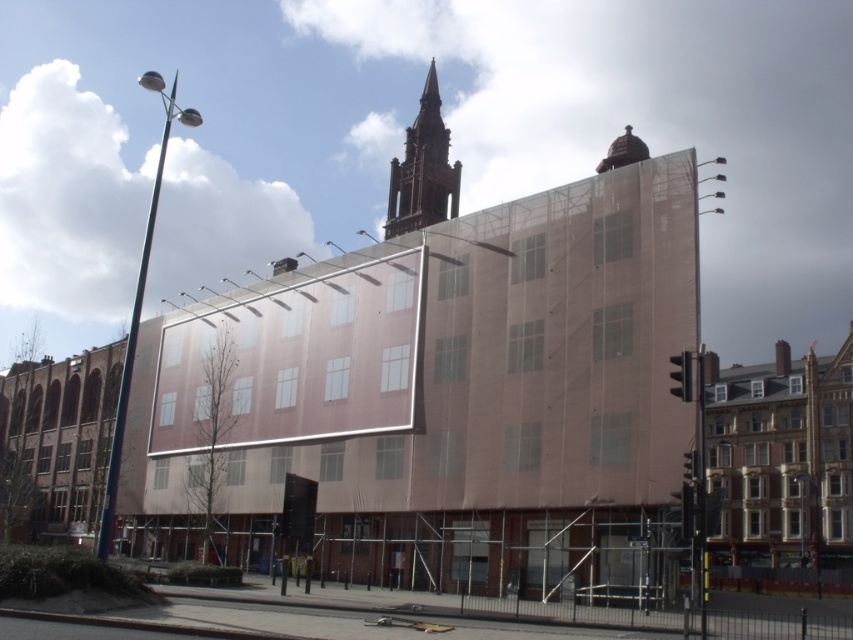
You are standing at the base of the building under construction in the image. Looking towards the church spire, you notice a specific point marked at coordinates point (781, 458). What does this point represent?

The point (781, 458) corresponds to the golden stone church at right.

You are a city planner analyzing the urban layout. Based on the image, which of the two churches, the brown stone church at center or the golden stone church at right, has a greater width?

The brown stone church at center might be wider than golden stone church at right according to the description.

You are an architect evaluating the urban skyline. Which of the two structures, the brown stone church at center or the brown stone tower at upper center, has a greater height?

The brown stone church at center has a greater height compared to the brown stone tower at upper center.